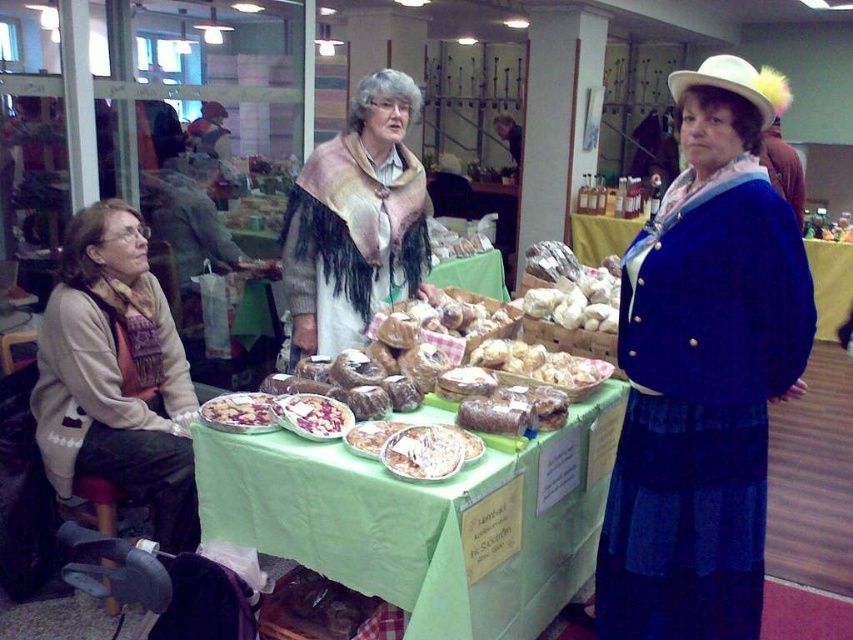
Question: Which point is farther to the camera?

Choices:
 (A) golden brown bread at center
 (B) white glossy pie at center
 (C) beige fringed shawl at center

Answer: (C)

Question: Is the position of white creamy cake at center less distant than that of white glossy pie at center?

Choices:
 (A) no
 (B) yes

Answer: (B)

Question: Does bread at center have a larger size compared to bread matte at center?

Choices:
 (A) no
 (B) yes

Answer: (B)

Question: Among these points, which one is farthest from the camera?

Choices:
 (A) (299, 408)
 (B) (654, 621)

Answer: (A)

Question: Is velvet blue coat at right to the right of white glossy pie at center from the viewer's perspective?

Choices:
 (A) yes
 (B) no

Answer: (A)

Question: Among these points, which one is farthest from the camera?

Choices:
 (A) (419, 109)
 (B) (381, 442)
 (C) (305, 545)
 (D) (175, 396)

Answer: (A)